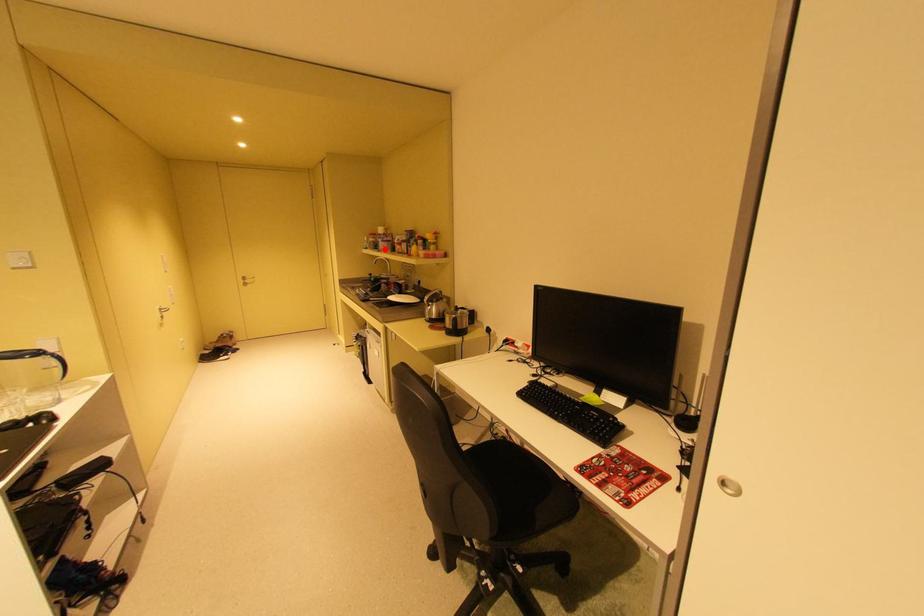
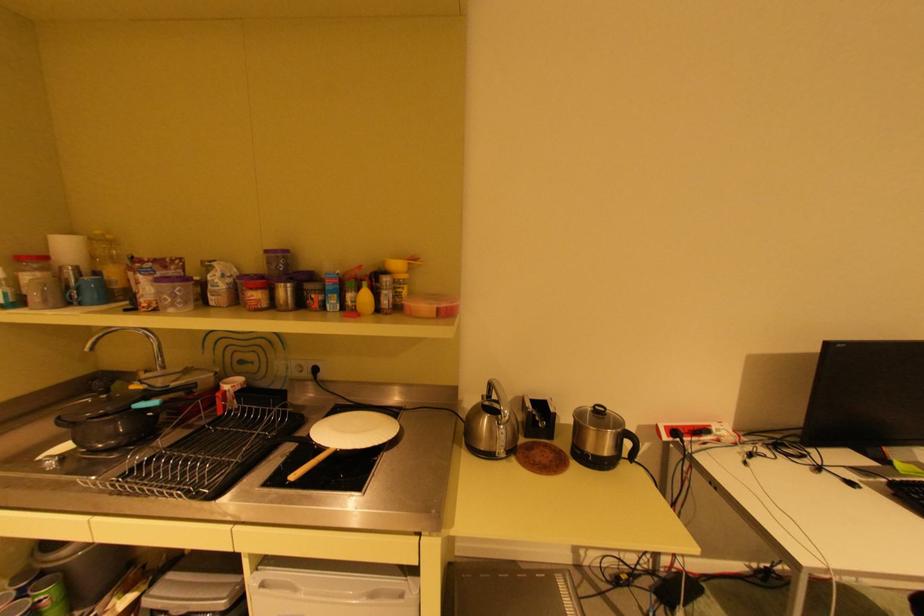
Locate, in the second image, the point that corresponds to the highlighted location in the first image.

(79, 302)